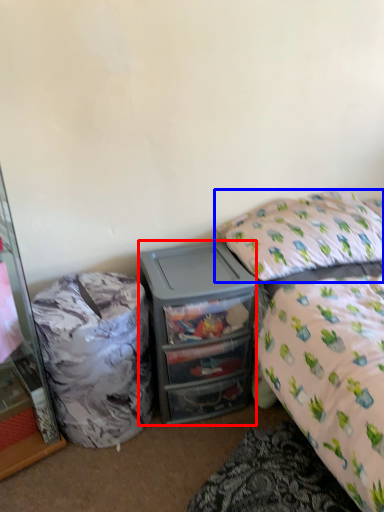
Question: Which object is further to the camera taking this photo, desk (highlighted by a red box) or pillow (highlighted by a blue box)?

Choices:
 (A) desk
 (B) pillow

Answer: (A)